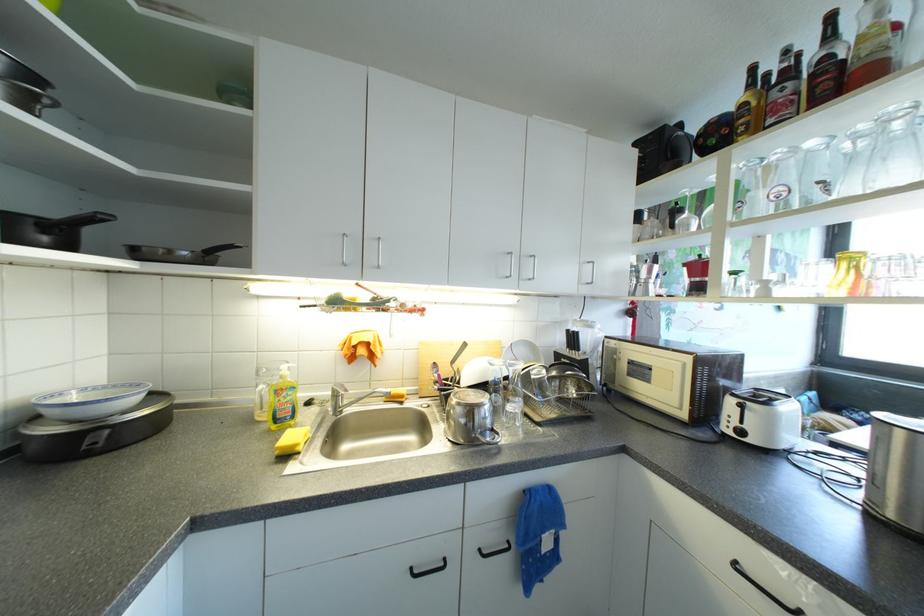
The width and height of the screenshot is (924, 616). What do you see at coordinates (84, 219) in the screenshot?
I see `the black pan handle` at bounding box center [84, 219].